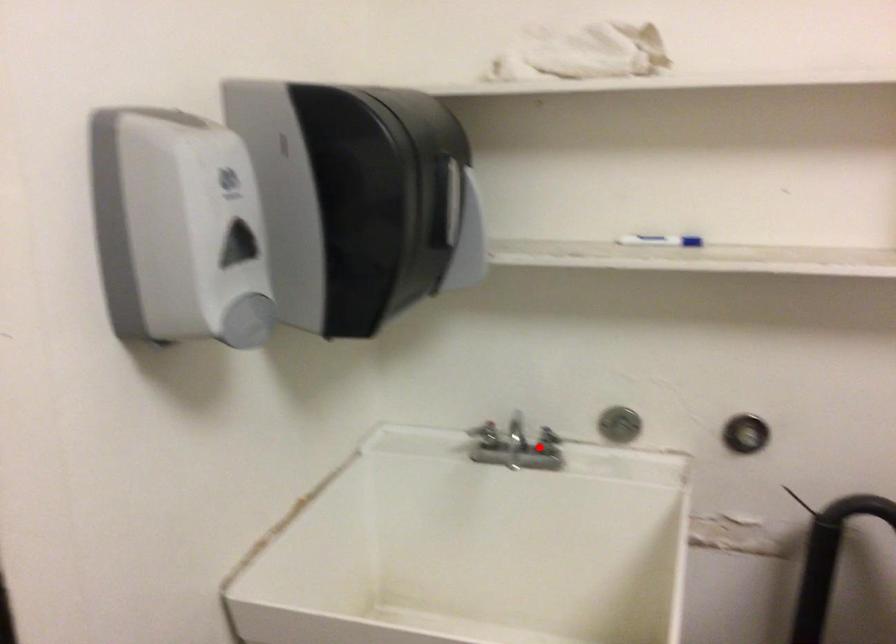
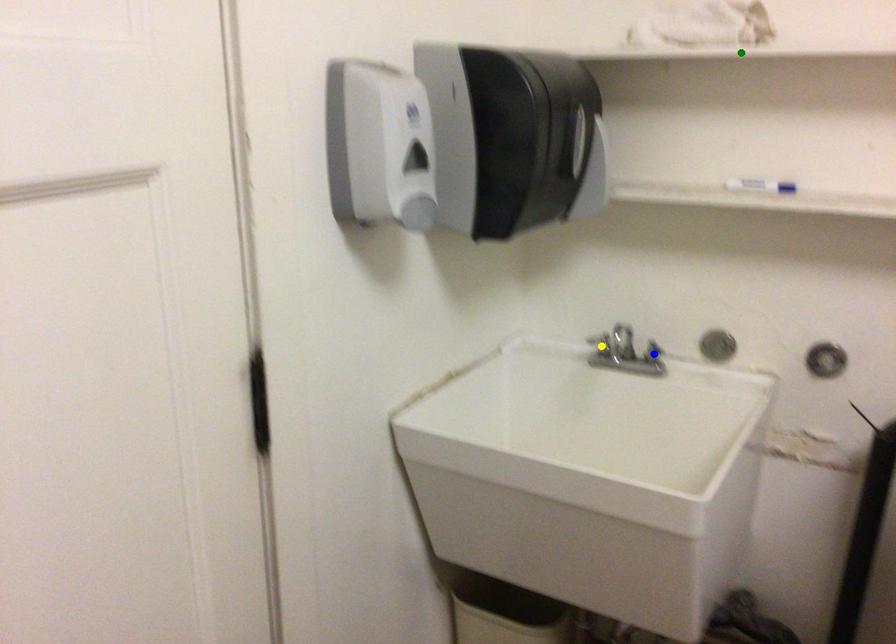
Question: I am providing you with two images of the same scene from different viewpoints. A red point is marked on the first image. You are given multiple points on the second image. Which spot in image 2 lines up with the point in image 1?

Choices:
 (A) yellow point
 (B) blue point
 (C) green point

Answer: (B)